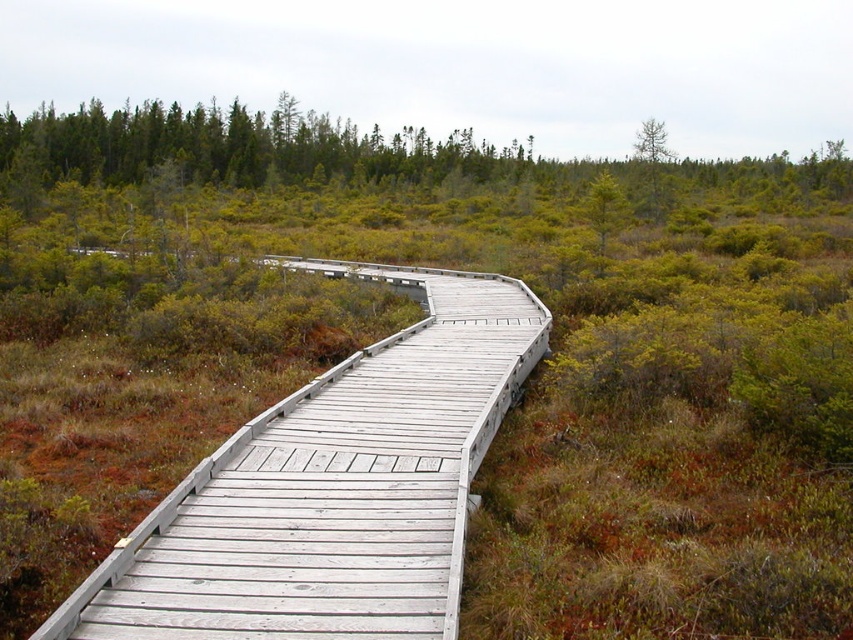
You are standing on the wooden boardwalk in the marshy landscape. You notice two points marked on the boardwalk at coordinates point (x=604, y=200) and point (x=641, y=160). If you are facing the direction the boardwalk curves to the right, which point is closer to you?

Point (x=604, y=200) is in front of point (x=641, y=160), so if you are facing the direction the boardwalk curves to the right, point (x=604, y=200) is closer to you.

You are a hiker trying to cross the marsh using the boardwalk. You see the light gray wooden bridge at center and the green matte tree at upper right. Which object is located more to the left side of the scene?

The light gray wooden bridge at center is positioned on the left side of green matte tree at upper right, so it is more to the left in the scene.

You are a hiker trying to cross the marshy area. You see the light gray wooden bridge at center and the green matte tree at upper center. Which one takes up more area in the image?

The green matte tree at upper center takes up more area in the image than the light gray wooden bridge at center because the light gray wooden bridge at center occupies less space than green matte tree at upper center.